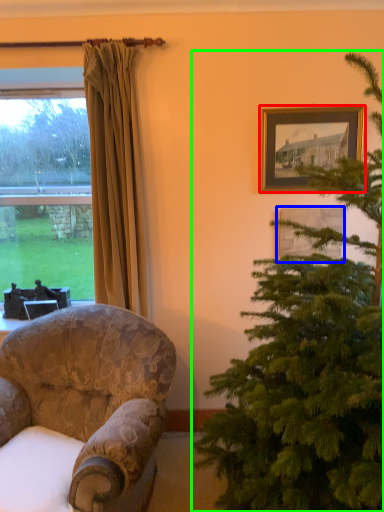
Question: Which is nearer to the picture frame (highlighted by a red box)? picture frame (highlighted by a blue box) or christmas tree (highlighted by a green box).

Choices:
 (A) picture frame
 (B) christmas tree

Answer: (A)